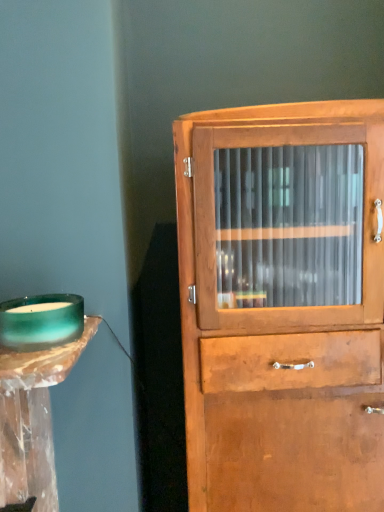
Question: In terms of width, does teal glass candle holder at left look wider or thinner when compared to wooden cabinet at center?

Choices:
 (A) thin
 (B) wide

Answer: (A)

Question: Is point (31, 329) closer or farther from the camera than point (177, 189)?

Choices:
 (A) farther
 (B) closer

Answer: (B)

Question: From a real-world perspective, is teal glass candle holder at left physically located above or below wooden cabinet at center?

Choices:
 (A) above
 (B) below

Answer: (A)

Question: From a real-world perspective, is wooden cabinet at center physically located above or below teal glass candle holder at left?

Choices:
 (A) above
 (B) below

Answer: (B)

Question: Is wooden cabinet at center taller or shorter than teal glass candle holder at left?

Choices:
 (A) short
 (B) tall

Answer: (B)

Question: Relative to teal glass candle holder at left, is wooden cabinet at center in front or behind?

Choices:
 (A) front
 (B) behind

Answer: (B)

Question: Considering the positions of wooden cabinet at center and teal glass candle holder at left in the image, is wooden cabinet at center bigger or smaller than teal glass candle holder at left?

Choices:
 (A) big
 (B) small

Answer: (A)